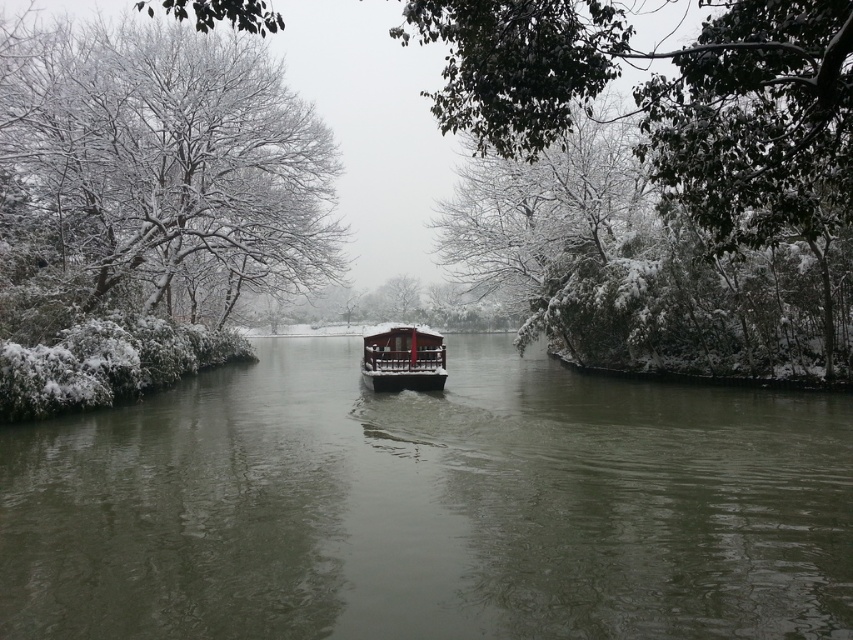
Question: Does snow-covered tree at center come in front of shiny dark wood boat at center?

Choices:
 (A) yes
 (B) no

Answer: (A)

Question: Which of these objects is positioned closest to the snow-covered branches at left?

Choices:
 (A) snow-covered tree at center
 (B) shiny dark wood boat at center
 (C) greenish-gray water at center

Answer: (A)

Question: From the image, what is the correct spatial relationship of greenish-gray water at center in relation to shiny dark wood boat at center?

Choices:
 (A) left
 (B) right

Answer: (B)

Question: Can you confirm if greenish-gray water at center is positioned above snow-covered tree at center?

Choices:
 (A) no
 (B) yes

Answer: (A)

Question: Among these objects, which one is nearest to the camera?

Choices:
 (A) snow-covered branches at left
 (B) greenish-gray water at center
 (C) snow-covered tree at center

Answer: (B)

Question: Estimate the real-world distances between objects in this image. Which object is closer to the snow-covered branches at left?

Choices:
 (A) snow-covered tree at center
 (B) greenish-gray water at center
 (C) shiny dark wood boat at center

Answer: (A)